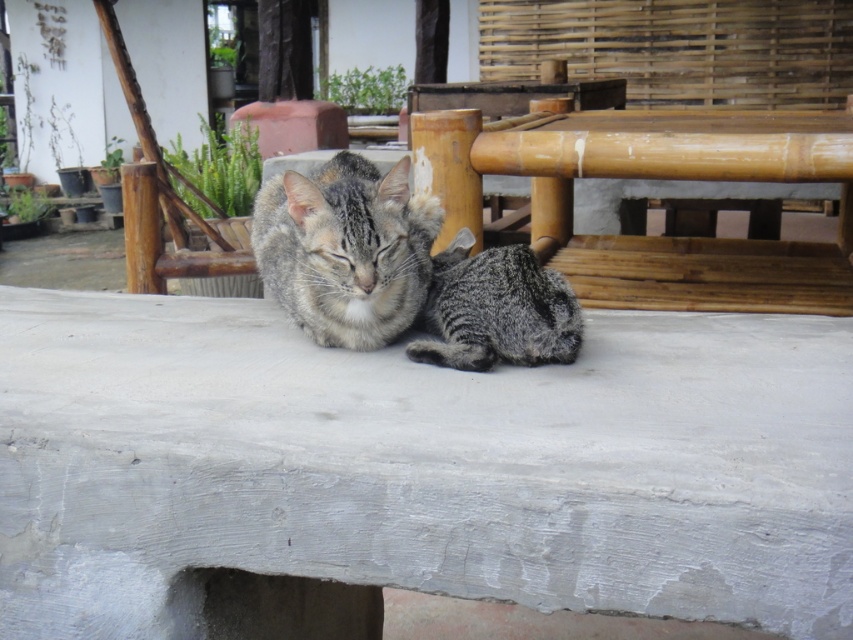
Question: Which point is farther from the camera taking this photo?

Choices:
 (A) (612, 273)
 (B) (505, 282)

Answer: (A)

Question: Which object is the closest to the bamboo table at center?

Choices:
 (A) gray concrete at center
 (B) gray striped fur cat at center

Answer: (B)

Question: Is bamboo table at center further to camera compared to gray striped fur cat at center?

Choices:
 (A) yes
 (B) no

Answer: (A)

Question: Can you confirm if bamboo table at center is positioned above gray fur cat at center?

Choices:
 (A) no
 (B) yes

Answer: (B)

Question: Does bamboo table at center appear on the left side of gray fur cat at center?

Choices:
 (A) no
 (B) yes

Answer: (A)

Question: Which of these objects is positioned closest to the bamboo table at center?

Choices:
 (A) gray striped fur cat at center
 (B) gray fur cat at center

Answer: (B)